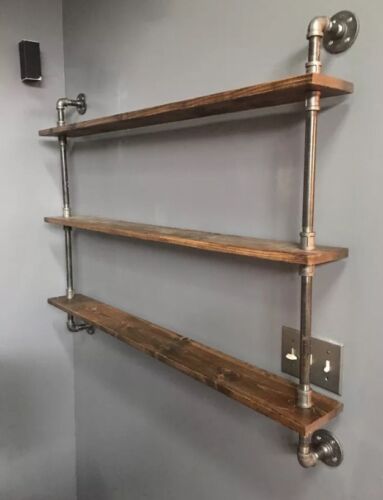
This screenshot has height=500, width=383. I want to click on light switch, so click(290, 353), click(311, 362), click(327, 364).